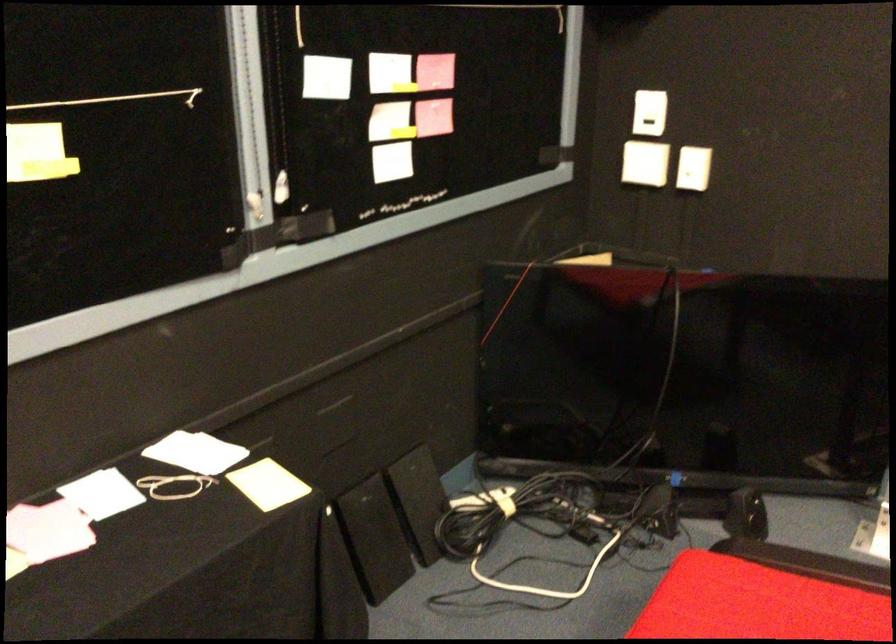
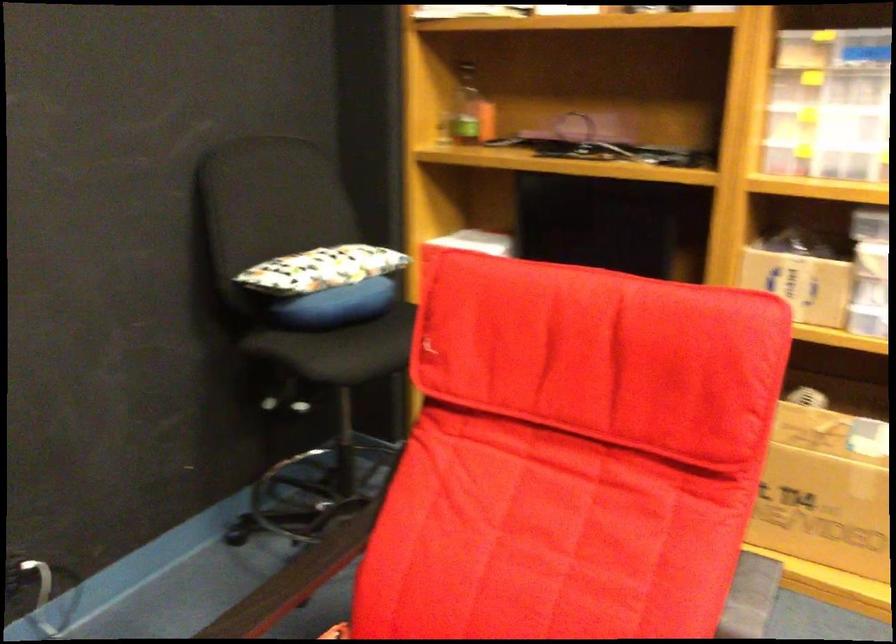
How did the camera likely rotate?

The camera rotated toward right-down.